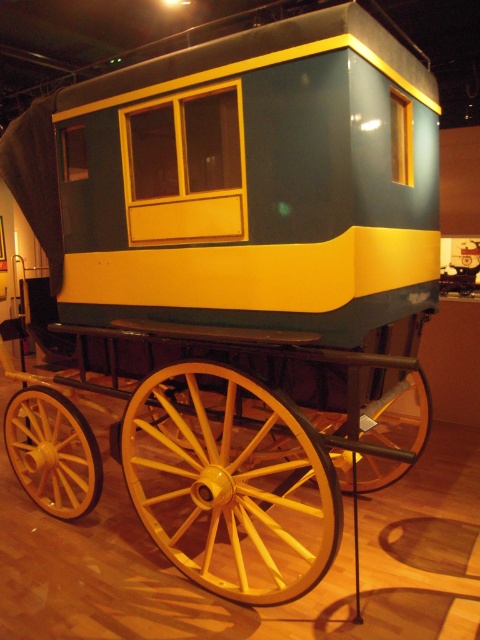
You are an interior designer planning to place a decorative item between the yellow wood wagon wheel at center and the yellow wooden wagon wheel at lower center. Which wheel should the item be placed closer to if you want it to be closer to the wider wheel?

The yellow wood wagon wheel at center might be wider than yellow wooden wagon wheel at lower center, so place the item closer to the yellow wood wagon wheel at center.